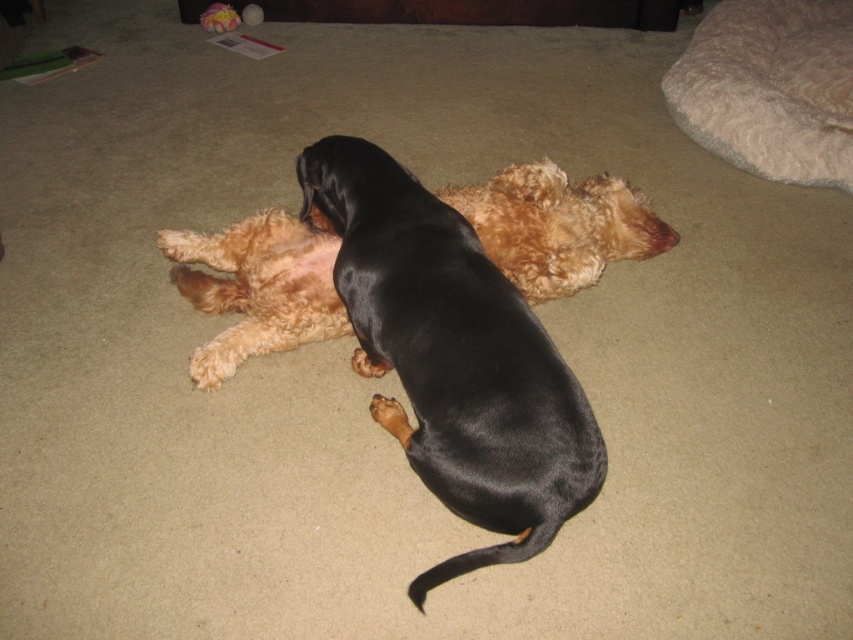
Can you confirm if black shiny dog at center is shorter than fluffy beige dog bed at upper right?

Incorrect, black shiny dog at center's height does not fall short of fluffy beige dog bed at upper right's.

Find the location of a particular element. The width and height of the screenshot is (853, 640). black shiny dog at center is located at coordinates (453, 356).

Is black shiny dog at center below shiny black coat at center?

Yes, black shiny dog at center is below shiny black coat at center.

Can you confirm if black shiny dog at center is positioned to the right of shiny black coat at center?

Yes, black shiny dog at center is to the right of shiny black coat at center.

Which is in front, point (503, 365) or point (549, 268)?

Positioned in front is point (503, 365).

Where is `black shiny dog at center`? The width and height of the screenshot is (853, 640). black shiny dog at center is located at coordinates (453, 356).

Can you confirm if shiny black coat at center is thinner than fluffy beige dog bed at upper right?

Yes, shiny black coat at center is thinner than fluffy beige dog bed at upper right.

Can you confirm if shiny black coat at center is smaller than fluffy beige dog bed at upper right?

Indeed, shiny black coat at center has a smaller size compared to fluffy beige dog bed at upper right.

What do you see at coordinates (258, 288) in the screenshot?
I see `shiny black coat at center` at bounding box center [258, 288].

I want to click on shiny black coat at center, so click(x=258, y=288).